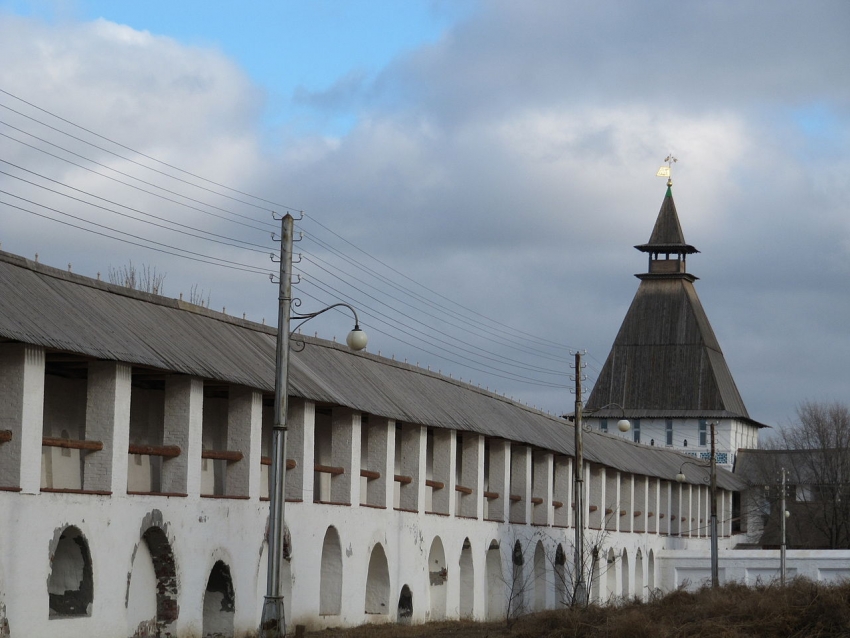
What are the coordinates of `arch windows` in the screenshot? It's located at (69, 575), (218, 602), (337, 579), (465, 587).